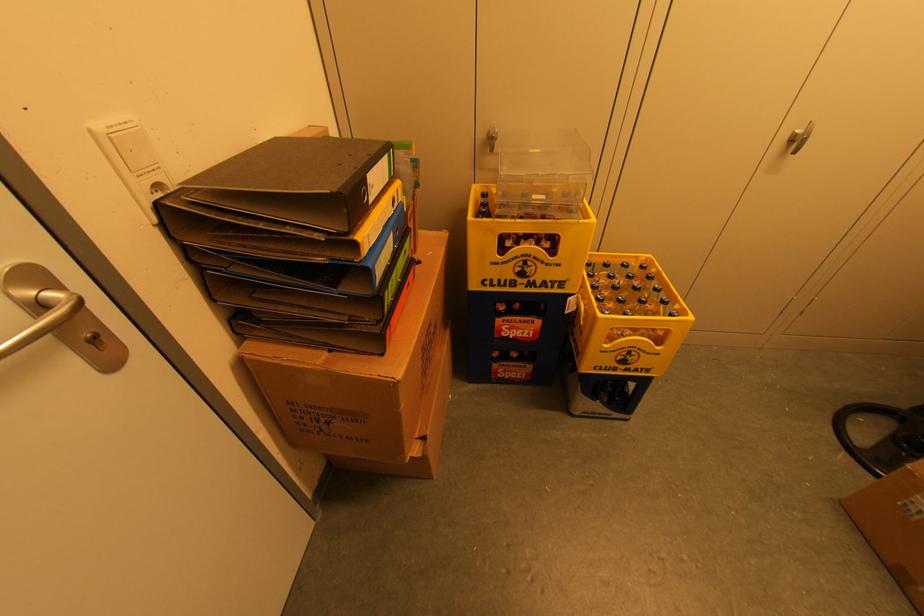
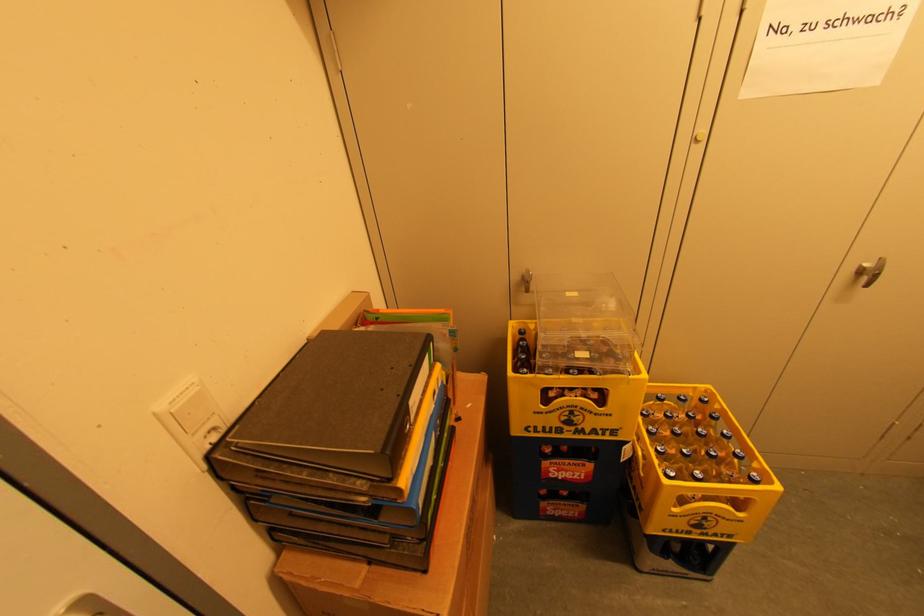
Question: The first image is from the beginning of the video and the second image is from the end. How did the camera likely rotate when shooting the video?

Choices:
 (A) Left
 (B) Right
 (C) Up
 (D) Down

Answer: (C)